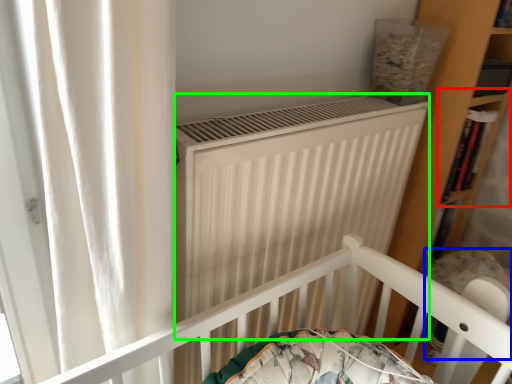
Question: Based on their relative distances, which object is nearer to shelf (highlighted by a red box)? Choose from baby carriage (highlighted by a blue box) and heater (highlighted by a green box).

Choices:
 (A) baby carriage
 (B) heater

Answer: (A)